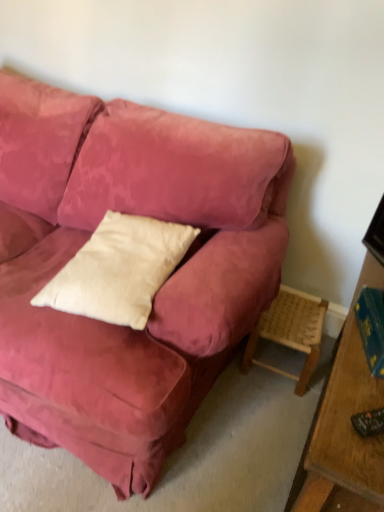
Question: Is hardcover book at right turned away from woven wood stool at lower right?

Choices:
 (A) no
 (B) yes

Answer: (A)

Question: Are hardcover book at right and woven wood stool at lower right far apart?

Choices:
 (A) yes
 (B) no

Answer: (B)

Question: Considering the relative positions of hardcover book at right and woven wood stool at lower right in the image provided, is hardcover book at right behind woven wood stool at lower right?

Choices:
 (A) yes
 (B) no

Answer: (B)

Question: Is hardcover book at right oriented towards woven wood stool at lower right?

Choices:
 (A) no
 (B) yes

Answer: (A)

Question: Does hardcover book at right have a larger size compared to woven wood stool at lower right?

Choices:
 (A) yes
 (B) no

Answer: (B)

Question: From their relative heights in the image, would you say hardcover book at right is taller or shorter than white cotton pillow at center?

Choices:
 (A) short
 (B) tall

Answer: (A)

Question: Considering the relative positions of hardcover book at right and white cotton pillow at center in the image provided, is hardcover book at right to the left or to the right of white cotton pillow at center?

Choices:
 (A) right
 (B) left

Answer: (A)

Question: From the image's perspective, is hardcover book at right positioned above or below white cotton pillow at center?

Choices:
 (A) above
 (B) below

Answer: (B)

Question: In terms of size, does hardcover book at right appear bigger or smaller than white cotton pillow at center?

Choices:
 (A) big
 (B) small

Answer: (B)

Question: Is white cotton pillow at center inside the boundaries of woven wood stool at lower right, or outside?

Choices:
 (A) inside
 (B) outside

Answer: (B)

Question: From a real-world perspective, is white cotton pillow at center positioned above or below woven wood stool at lower right?

Choices:
 (A) below
 (B) above

Answer: (B)

Question: Looking at their shapes, would you say white cotton pillow at center is wider or thinner than woven wood stool at lower right?

Choices:
 (A) thin
 (B) wide

Answer: (B)

Question: From their relative heights in the image, would you say white cotton pillow at center is taller or shorter than woven wood stool at lower right?

Choices:
 (A) tall
 (B) short

Answer: (B)

Question: Does point (322, 312) appear closer or farther from the camera than point (172, 256)?

Choices:
 (A) closer
 (B) farther

Answer: (B)

Question: Considering the positions of woven wood stool at lower right and white cotton pillow at center in the image, is woven wood stool at lower right wider or thinner than white cotton pillow at center?

Choices:
 (A) wide
 (B) thin

Answer: (B)